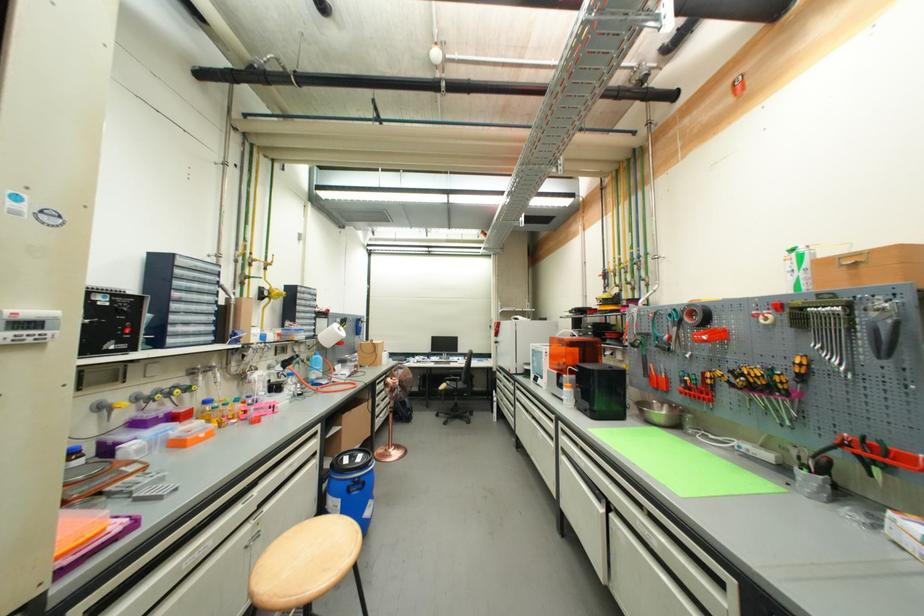
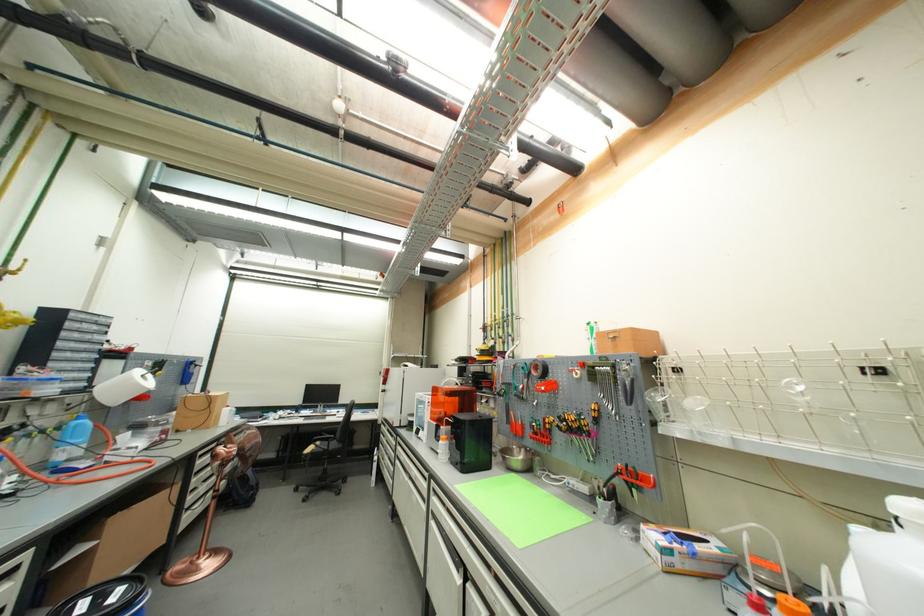
Find the pixel in the second image that matches (x=808, y=374) in the first image.

(602, 418)